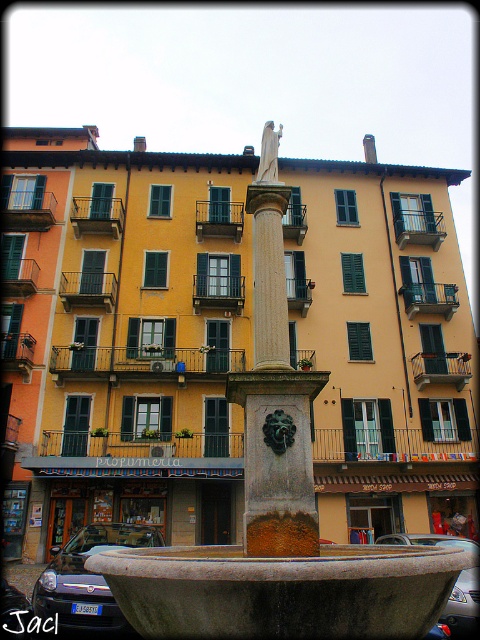
From the picture: Does stone fountain at center have a lesser width compared to white marble statue at center?

Incorrect, stone fountain at center's width is not less than white marble statue at center's.

Does stone fountain at center appear over white marble statue at center?

Actually, stone fountain at center is below white marble statue at center.

Describe the element at coordinates (273, 509) in the screenshot. The height and width of the screenshot is (640, 480). I see `stone fountain at center` at that location.

Image resolution: width=480 pixels, height=640 pixels. Find the location of `stone fountain at center`. stone fountain at center is located at coordinates (273, 509).